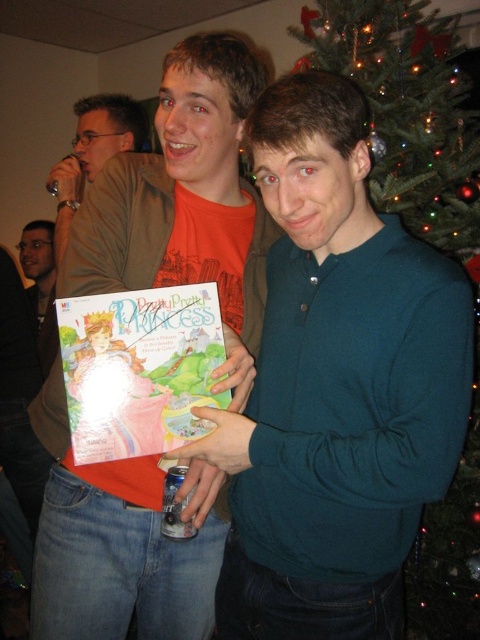
You are a photographer trying to capture a candid shot of the matte orange shirt at center without being noticed. The camera you are using has a focal length of 50mm and requires a minimum distance of 1 meter to focus properly. Based on the scene description, can you take the photo from your current position?

The matte orange shirt at center and camera are 97.80 centimeters apart, which is less than the required 1 meter. Therefore, you cannot take the photo from your current position as the distance is insufficient for proper focus.

You are planning to place a new decoration on the green artificial christmas tree at upper right and the matte khaki shirt at left. Based on their sizes, which object can accommodate a larger decoration?

The green artificial christmas tree at upper right might be wider than matte khaki shirt at left, so it can accommodate a larger decoration.